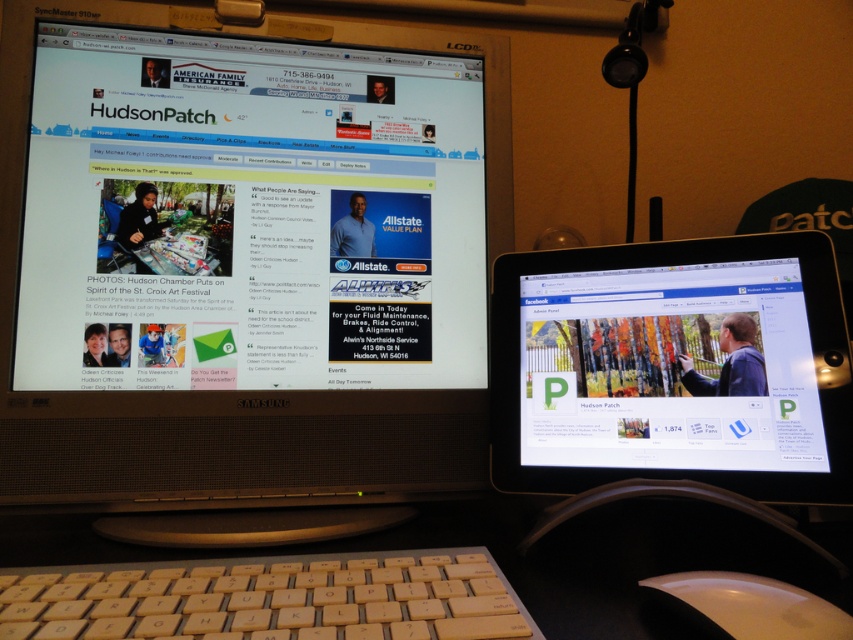
Question: Is white plastic keyboard at lower center thinner than yellow plastic keyboard at lower center?

Choices:
 (A) yes
 (B) no

Answer: (B)

Question: Does matte black monitor at left have a lesser width compared to white plastic keyboard at lower center?

Choices:
 (A) no
 (B) yes

Answer: (B)

Question: Which point is closer to the camera?

Choices:
 (A) (45, 589)
 (B) (769, 433)
 (C) (370, 572)
 (D) (48, 480)

Answer: (A)

Question: Which of the following is the farthest from the observer?

Choices:
 (A) (235, 605)
 (B) (674, 545)
 (C) (700, 364)

Answer: (C)

Question: Is the position of matte white tablet at right more distant than that of yellow plastic keyboard at lower center?

Choices:
 (A) no
 (B) yes

Answer: (B)

Question: Which point is closer to the camera?

Choices:
 (A) matte black monitor at left
 (B) white plastic keyboard at lower center
 (C) white glossy mouse at lower right

Answer: (C)